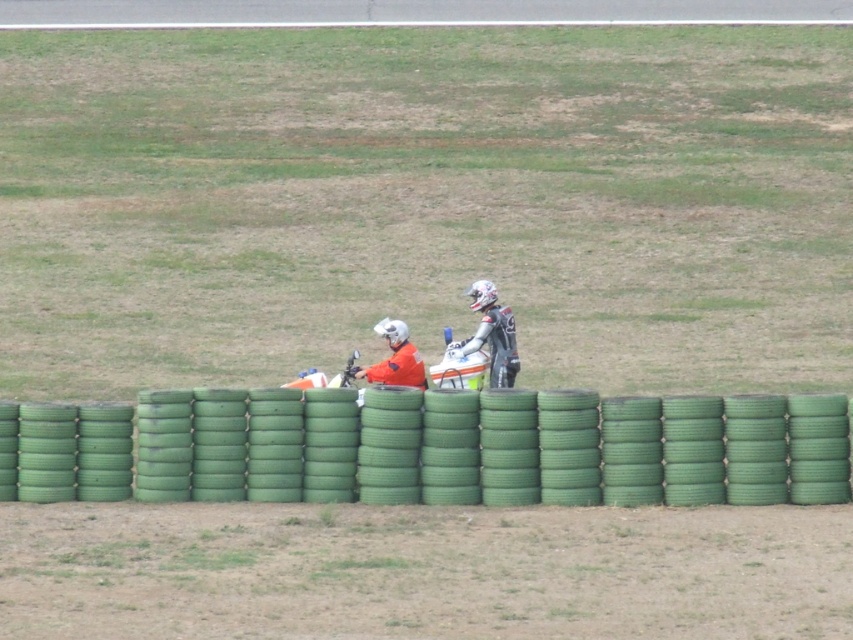
Question: Based on their relative distances, which object is nearer to the orange fabric jacket at center?

Choices:
 (A) asphalt at center
 (B) white matte motorcycle at center

Answer: (B)

Question: Is white matte motorcycle at center to the right of orange fabric jacket at center from the viewer's perspective?

Choices:
 (A) no
 (B) yes

Answer: (B)

Question: Is green rubber tires at center positioned at the back of white matte motorcycle at center?

Choices:
 (A) no
 (B) yes

Answer: (A)

Question: Which object is farther from the camera taking this photo?

Choices:
 (A) green rubber tires at center
 (B) asphalt at center
 (C) white matte motorcycle at center
 (D) orange fabric jacket at center

Answer: (B)

Question: Considering the relative positions of white matte motorcycle at center and orange fabric jacket at center in the image provided, where is white matte motorcycle at center located with respect to orange fabric jacket at center?

Choices:
 (A) below
 (B) above

Answer: (B)

Question: Estimate the real-world distances between objects in this image. Which object is closer to the green rubber tires at center?

Choices:
 (A) orange fabric jacket at center
 (B) white matte motorcycle at center
 (C) asphalt at center

Answer: (A)